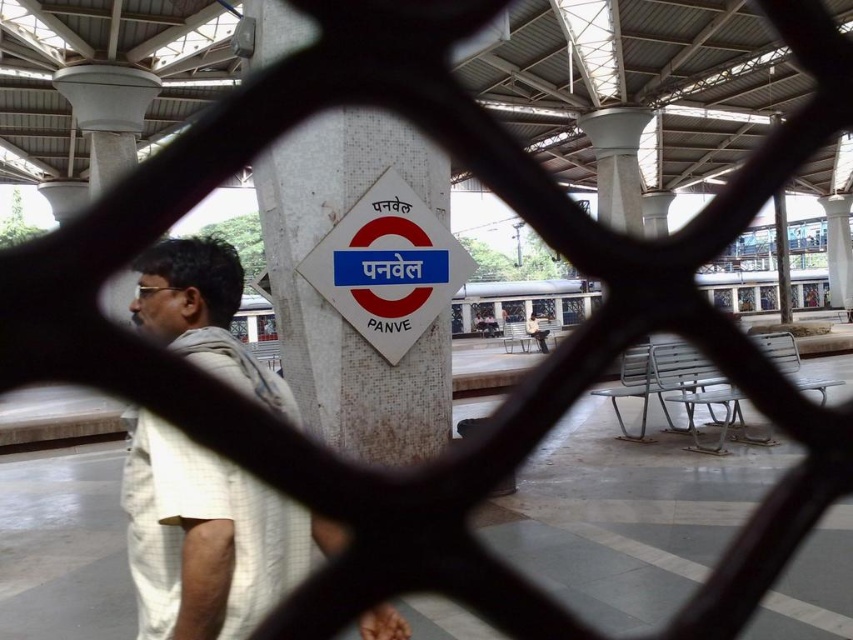
You are standing at the train station platform and want to take a photo of the signpost that says PANVEL. The camera you are using has a focal length of 50mm and a sensor size of 24mm x 36mm. The point at coordinate point (199, 576) is part of the signpost. If you want to ensure that the entire signpost is in focus, what is the minimum distance you should be from the signpost?

The point at coordinate (199, 576) is 5.18 feet from the camera. To ensure the entire signpost is in focus, you should be at least 5.18 feet away from the signpost.

You are standing at the point marked with coordinates point (264, 170). The metal fence is between you and the signpost. If you walk straight towards the signpost, will you hit the fence first or reach the signpost first?

Since the distance between you and the signpost is 15.90 feet, and the fence is between you and the signpost, you will hit the fence first before reaching the signpost.